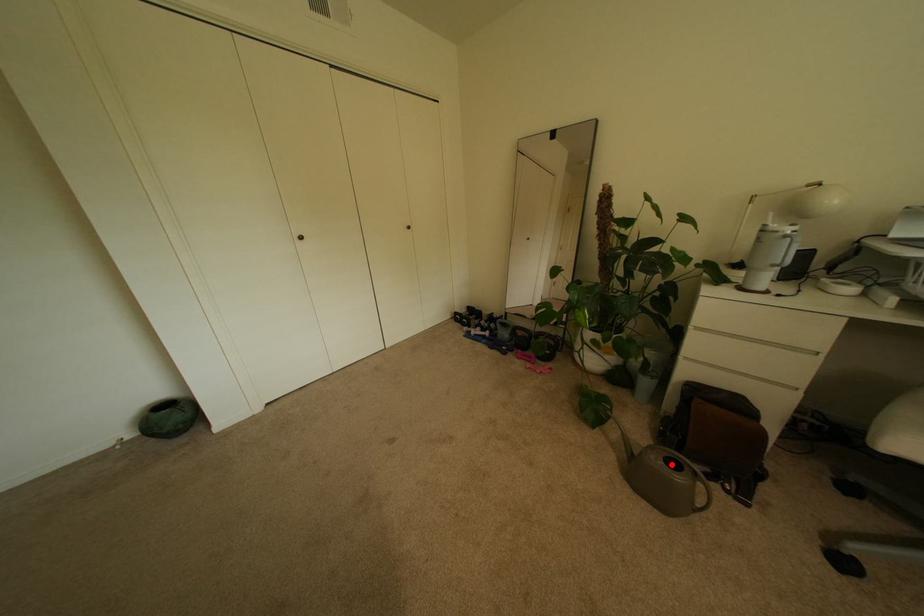
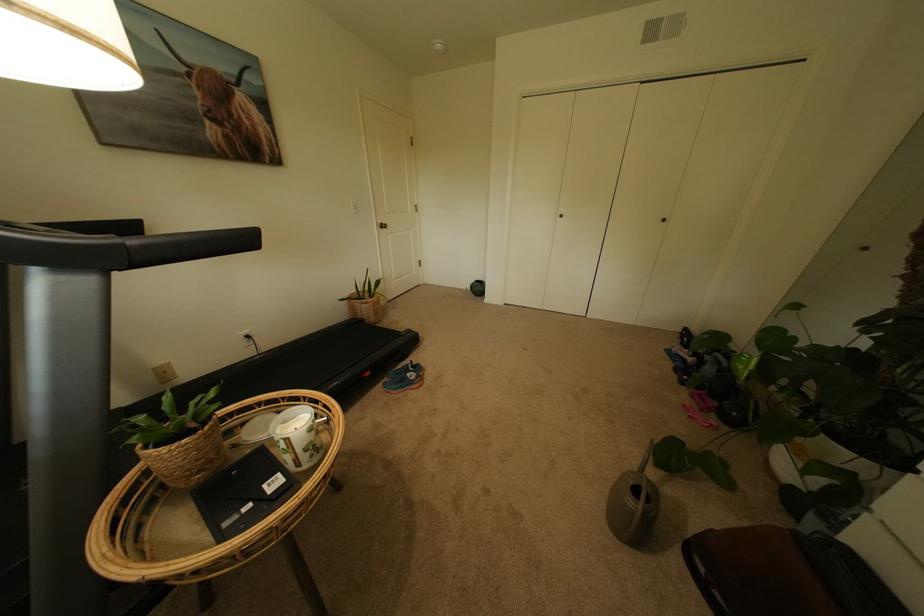
Find the pixel in the second image that matches the highlighted location in the first image.

(639, 484)